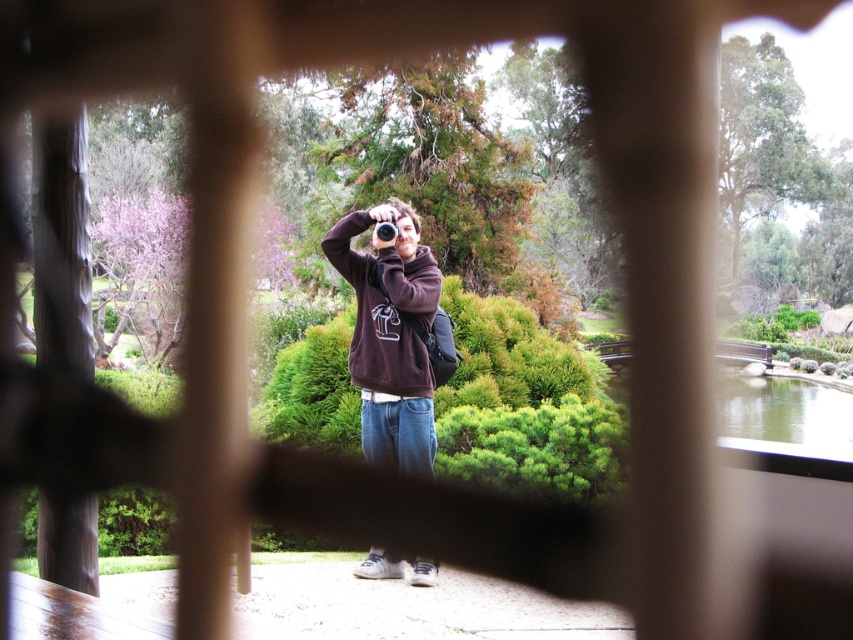
Question: Is brown fleece at center thinner than brown fleece sweatshirt at center?

Choices:
 (A) no
 (B) yes

Answer: (B)

Question: Is brown fleece sweatshirt at center bigger than black plastic camera at center?

Choices:
 (A) no
 (B) yes

Answer: (B)

Question: Which object is closer to the camera taking this photo?

Choices:
 (A) brown fleece sweatshirt at center
 (B) brown fleece at center
 (C) black plastic camera at center

Answer: (B)

Question: Does brown fleece sweatshirt at center appear on the right side of black plastic camera at center?

Choices:
 (A) no
 (B) yes

Answer: (B)

Question: Among these objects, which one is farthest from the camera?

Choices:
 (A) brown fleece at center
 (B) brown fleece sweatshirt at center

Answer: (B)

Question: Which point is farther to the camera?

Choices:
 (A) (380, 227)
 (B) (366, 365)
 (C) (358, 320)

Answer: (C)